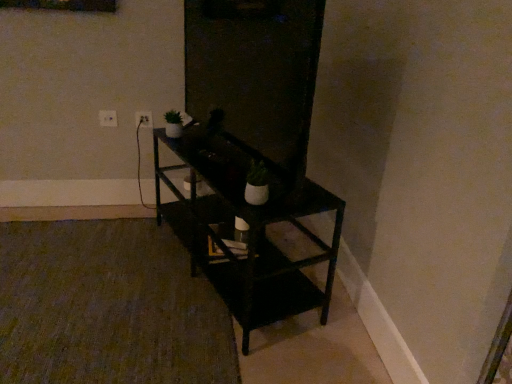
Question: Considering the relative sizes of black matte shelf at center and white plastic electric outlet at upper left, which appears as the second electric outlet when viewed from the left, in the image provided, is black matte shelf at center taller than white plastic electric outlet at upper left, which appears as the second electric outlet when viewed from the left,?

Choices:
 (A) no
 (B) yes

Answer: (B)

Question: Is black matte shelf at center completely or partially outside of white plastic electric outlet at upper left, positioned as the 1th electric outlet in right-to-left order?

Choices:
 (A) no
 (B) yes

Answer: (B)

Question: Is black matte shelf at center smaller than white plastic electric outlet at upper left, positioned as the 1th electric outlet in right-to-left order?

Choices:
 (A) yes
 (B) no

Answer: (B)

Question: Is black matte shelf at center facing away from white plastic electric outlet at upper left, positioned as the 1th electric outlet in right-to-left order?

Choices:
 (A) yes
 (B) no

Answer: (B)

Question: From the image's perspective, is black matte shelf at center above white plastic electric outlet at upper left, positioned as the 1th electric outlet in right-to-left order?

Choices:
 (A) no
 (B) yes

Answer: (A)

Question: Choose the correct answer: Is green matte houseplant at upper left, positioned as the first houseplant in top-to-bottom order, inside white plastic electric outlet at upper left, which appears as the second electric outlet when viewed from the left, or outside it?

Choices:
 (A) inside
 (B) outside

Answer: (B)

Question: Considering the positions of point (169, 132) and point (142, 112), is point (169, 132) closer or farther from the camera than point (142, 112)?

Choices:
 (A) closer
 (B) farther

Answer: (A)

Question: In terms of height, does green matte houseplant at upper left, the second houseplant positioned from the right, look taller or shorter compared to white plastic electric outlet at upper left, positioned as the 1th electric outlet in right-to-left order?

Choices:
 (A) short
 (B) tall

Answer: (B)

Question: From a real-world perspective, is green matte houseplant at upper left, the second houseplant when ordered from bottom to top, above or below white plastic electric outlet at upper left, positioned as the 1th electric outlet in right-to-left order?

Choices:
 (A) below
 (B) above

Answer: (B)

Question: Based on their sizes in the image, would you say white plastic electric outlet at upper left, positioned as the 1th electric outlet in right-to-left order, is bigger or smaller than white matte pot at center, the 2th houseplant when ordered from top to bottom?

Choices:
 (A) big
 (B) small

Answer: (B)

Question: From the image's perspective, is white plastic electric outlet at upper left, which appears as the second electric outlet when viewed from the left, located above or below white matte pot at center, which is counted as the 2th houseplant, starting from the left?

Choices:
 (A) above
 (B) below

Answer: (A)

Question: Is white plastic electric outlet at upper left, which appears as the second electric outlet when viewed from the left, wider or thinner than white matte pot at center, the 1th houseplant positioned from the right?

Choices:
 (A) thin
 (B) wide

Answer: (A)

Question: Based on their positions, is white plastic electric outlet at upper left, positioned as the 1th electric outlet in right-to-left order, located to the left or right of white matte pot at center, the 1th houseplant positioned from the right?

Choices:
 (A) right
 (B) left

Answer: (B)

Question: From a real-world perspective, is white plastic electric outlet at upper left, which appears as the second electric outlet when viewed from the left, above or below green matte houseplant at upper left, the second houseplant positioned from the right?

Choices:
 (A) below
 (B) above

Answer: (A)

Question: Relative to green matte houseplant at upper left, marked as the first houseplant in a left-to-right arrangement, is white plastic electric outlet at upper left, positioned as the 1th electric outlet in right-to-left order, in front or behind?

Choices:
 (A) behind
 (B) front

Answer: (A)